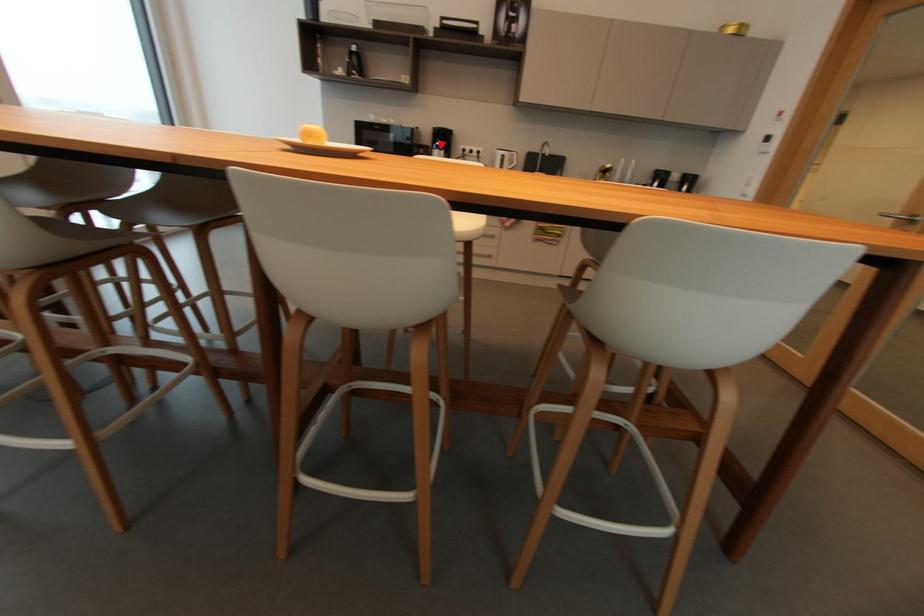
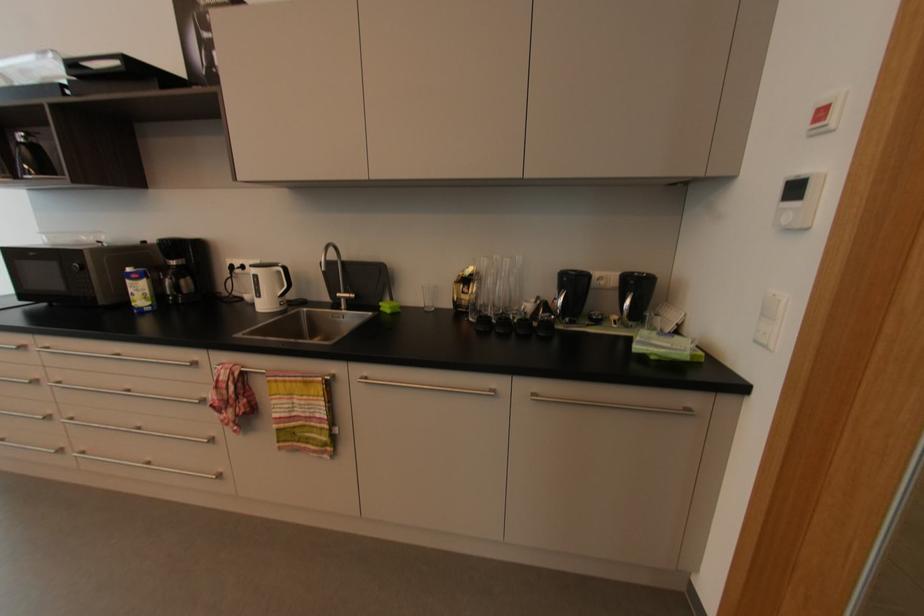
In the second image, find the point that corresponds to the highlighted location in the first image.

(131, 270)